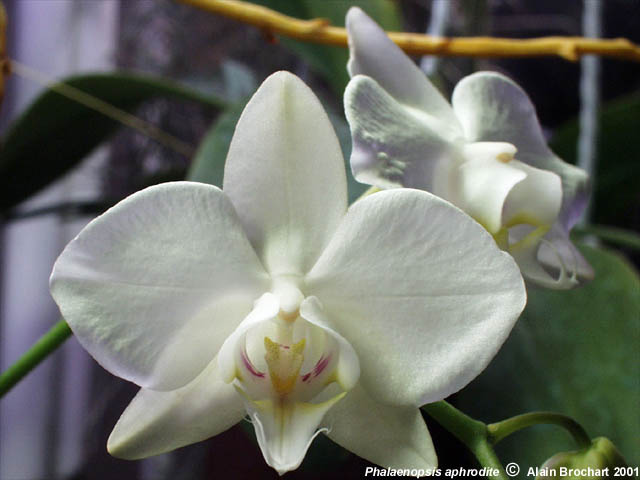
At what (x,y) coordinates should I click in order to perform the action: click on window. Please return your answer as a coordinate pair (x, y). Looking at the image, I should click on (614, 129).